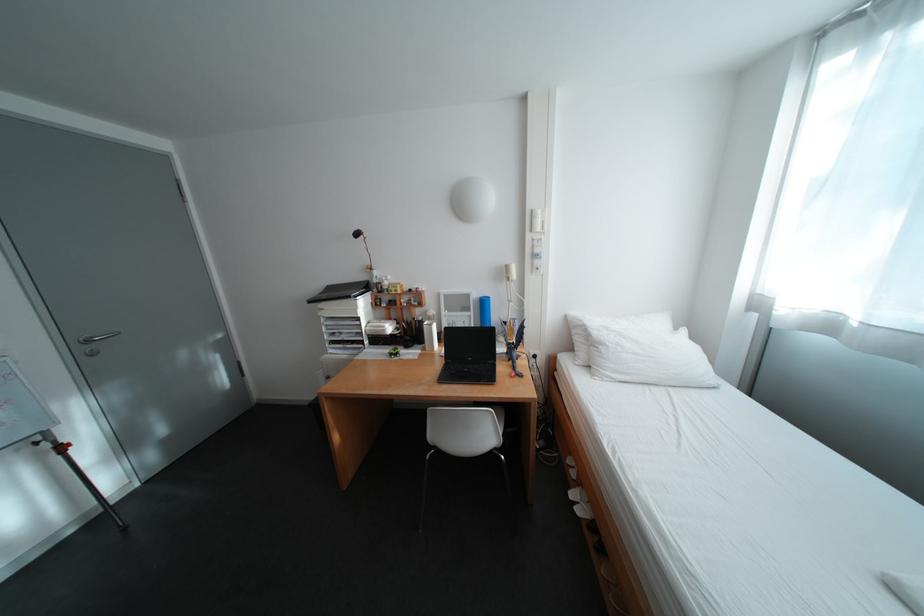
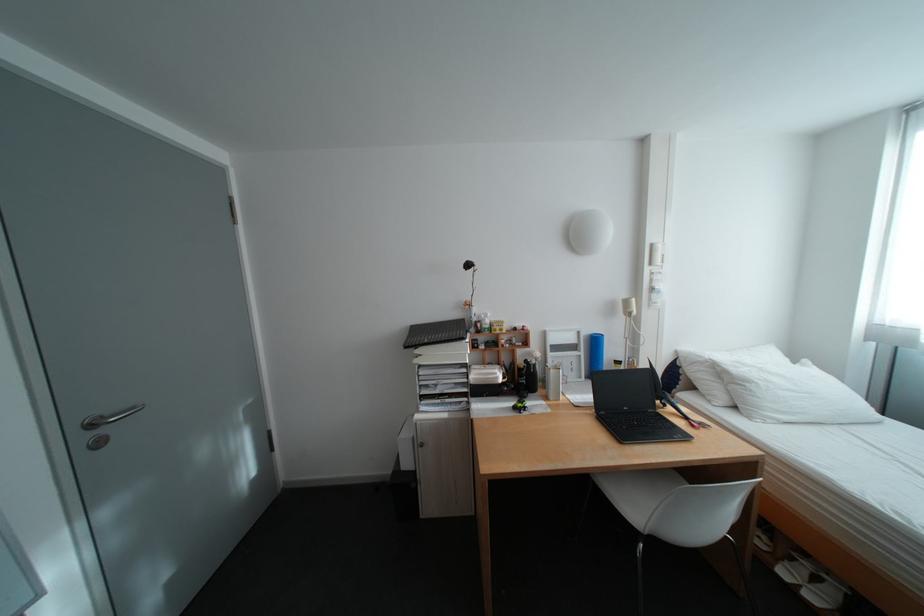
In the second image, find the point that corresponds to point (484, 314) in the first image.

(594, 354)